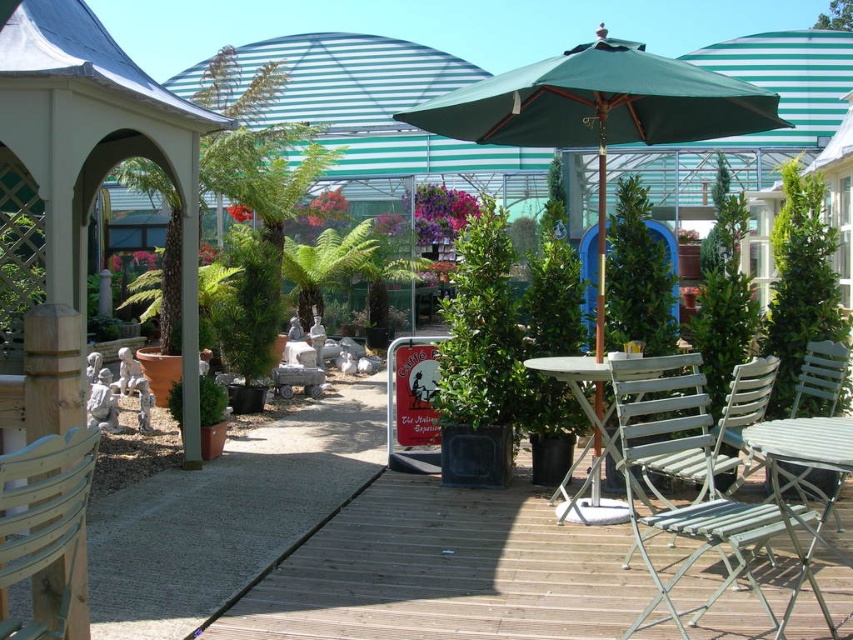
Question: Based on their relative distances, which object is nearer to the green leafy plant at left?

Choices:
 (A) light green metal chair at lower right
 (B) wooden gazebo at left
 (C) metallic silver chair at lower right

Answer: (B)

Question: Can you confirm if wooden deck at center is positioned to the right of green leafy plant at left?

Choices:
 (A) no
 (B) yes

Answer: (B)

Question: Which object appears closest to the camera in this image?

Choices:
 (A) metallic silver chair at lower right
 (B) wooden gazebo at left
 (C) light green metal table at center

Answer: (C)

Question: Can you confirm if green leafy bush at center is positioned below light green metal table at center?

Choices:
 (A) no
 (B) yes

Answer: (A)

Question: Is green fabric umbrella at center in front of light green metal chair at lower right?

Choices:
 (A) yes
 (B) no

Answer: (B)

Question: Based on their relative distances, which object is farther from the green leafy plant at left?

Choices:
 (A) light green metal chair at lower right
 (B) wooden deck at center
 (C) metallic silver chair at lower right
 (D) wooden gazebo at left

Answer: (C)